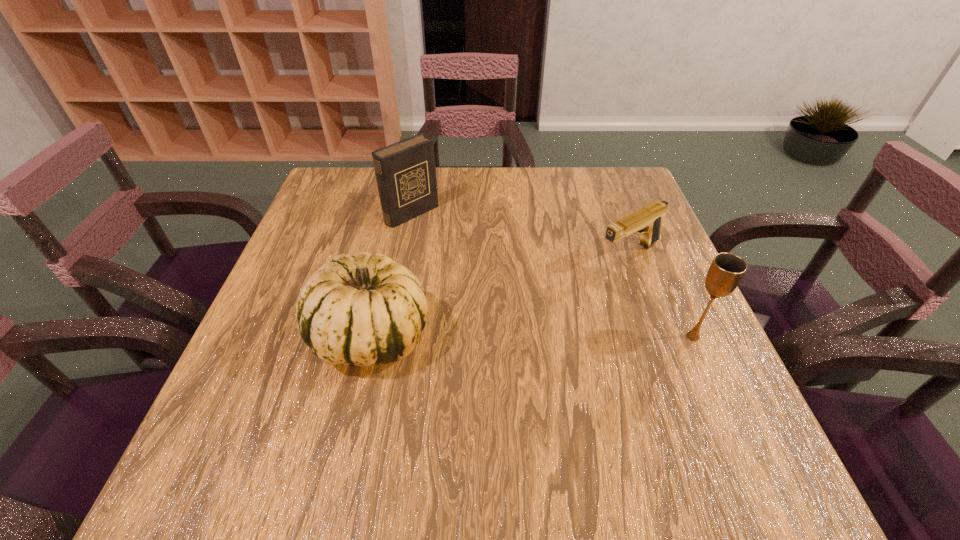
At what (x,y) coordinates should I click in order to perform the action: click on free spot between the pistol and the gourd. Please return your answer as a coordinate pair (x, y). This screenshot has width=960, height=540. Looking at the image, I should click on (501, 295).

You are a GUI agent. You are given a task and a screenshot of the screen. Output one action in this format:
    pyautogui.click(x=<x>, y=<y>)
    Task: Click on the vacant region between the diary and the third nearest object
    Image resolution: width=960 pixels, height=540 pixels.
    Given the screenshot: What is the action you would take?
    pyautogui.click(x=520, y=234)

Where is `free spot between the pistol and the chalice`? This screenshot has height=540, width=960. free spot between the pistol and the chalice is located at coordinates (661, 295).

Find the location of `object that is the closest to the farthest object`. object that is the closest to the farthest object is located at coordinates (366, 310).

Identify which object is the closest to the diary. Please provide its 2D coordinates. Your answer should be formatted as a tuple, i.e. [(x, y)], where the tuple contains the x and y coordinates of a point satisfying the conditions above.

[(366, 310)]

This screenshot has width=960, height=540. What are the coordinates of `free space that satisfies the following two spatial constraints: 1. on the front side of the farthest object; 2. on the right side of the pistol` in the screenshot? It's located at (404, 254).